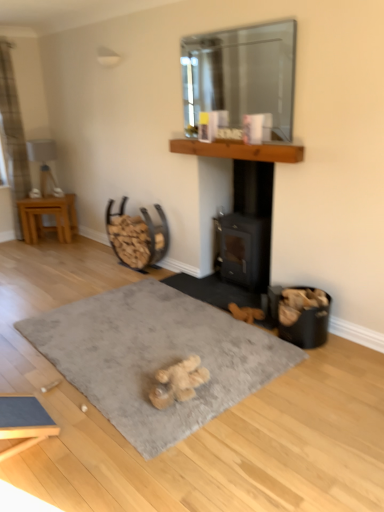
Question: Is transparent glass mirror at upper center wider than gray soft rug at center?

Choices:
 (A) yes
 (B) no

Answer: (B)

Question: From a real-world perspective, is transparent glass mirror at upper center on top of gray soft rug at center?

Choices:
 (A) yes
 (B) no

Answer: (A)

Question: Is transparent glass mirror at upper center taller than gray soft rug at center?

Choices:
 (A) no
 (B) yes

Answer: (B)

Question: Can gray soft rug at center be found inside transparent glass mirror at upper center?

Choices:
 (A) yes
 (B) no

Answer: (B)

Question: From a real-world perspective, is transparent glass mirror at upper center under gray soft rug at center?

Choices:
 (A) yes
 (B) no

Answer: (B)

Question: Considering the relative positions of transparent glass mirror at upper center and gray soft rug at center in the image provided, is transparent glass mirror at upper center to the right of gray soft rug at center from the viewer's perspective?

Choices:
 (A) yes
 (B) no

Answer: (A)

Question: Does brown wooden mantle at upper center have a greater height compared to transparent glass mirror at upper center?

Choices:
 (A) no
 (B) yes

Answer: (A)

Question: Is brown wooden mantle at upper center touching transparent glass mirror at upper center?

Choices:
 (A) no
 (B) yes

Answer: (A)

Question: Is the depth of brown wooden mantle at upper center less than that of transparent glass mirror at upper center?

Choices:
 (A) yes
 (B) no

Answer: (B)

Question: From the image's perspective, is brown wooden mantle at upper center beneath transparent glass mirror at upper center?

Choices:
 (A) yes
 (B) no

Answer: (A)

Question: From a real-world perspective, is brown wooden mantle at upper center located beneath transparent glass mirror at upper center?

Choices:
 (A) no
 (B) yes

Answer: (B)

Question: Considering the relative sizes of brown wooden mantle at upper center and transparent glass mirror at upper center in the image provided, is brown wooden mantle at upper center bigger than transparent glass mirror at upper center?

Choices:
 (A) yes
 (B) no

Answer: (B)

Question: Is gray soft rug at center oriented away from brown wooden mantle at upper center?

Choices:
 (A) yes
 (B) no

Answer: (B)